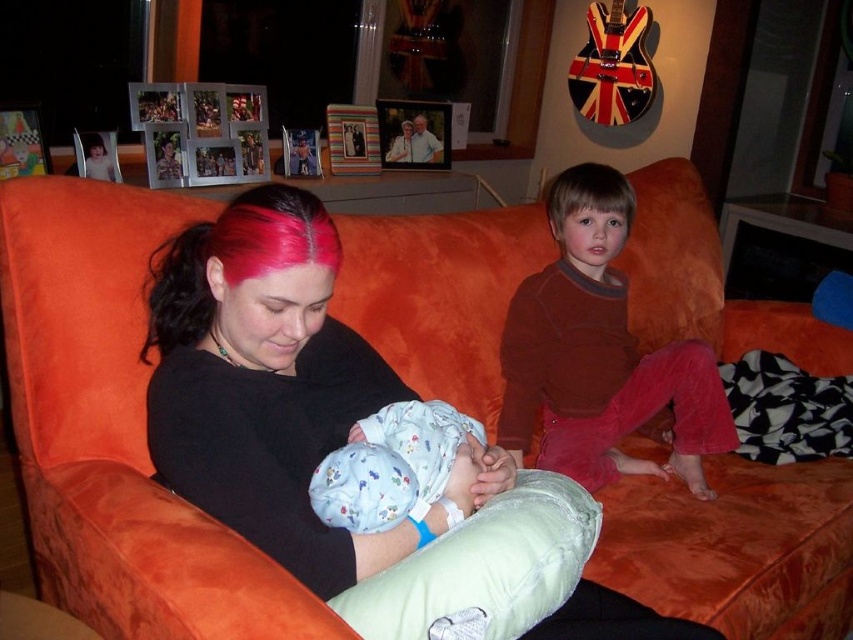
Question: Is pink matte hair at center to the right of fluffy cotton onesie at center from the viewer's perspective?

Choices:
 (A) yes
 (B) no

Answer: (B)

Question: Where is velvet orange couch at right located in relation to pink matte hair at center in the image?

Choices:
 (A) right
 (B) left

Answer: (A)

Question: Which point appears farthest from the camera in this image?

Choices:
 (A) (202, 298)
 (B) (621, 524)
 (C) (432, 493)

Answer: (B)

Question: Which object appears farthest from the camera in this image?

Choices:
 (A) pink matte hair at center
 (B) velvet orange couch at right

Answer: (B)

Question: Which is farther from the fluffy cotton onesie at center?

Choices:
 (A) velvet orange couch at right
 (B) pink matte hair at center

Answer: (A)

Question: Is orange velvet couch at center to the left of pink matte hair at center from the viewer's perspective?

Choices:
 (A) no
 (B) yes

Answer: (A)